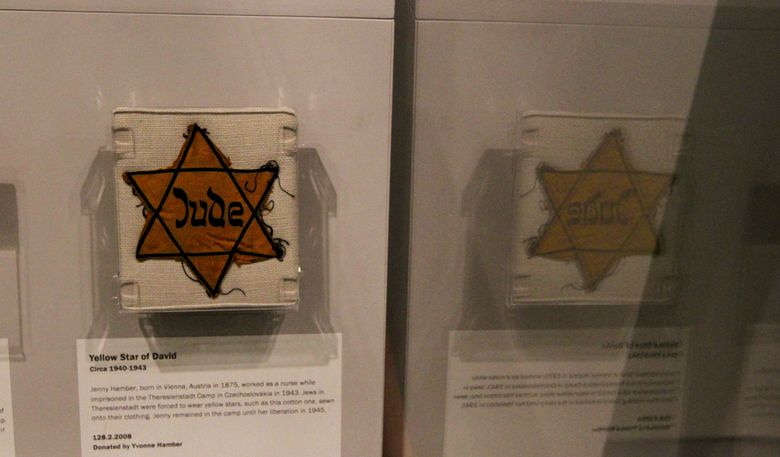
This screenshot has height=457, width=780. Find the location of `mirror`. mirror is located at coordinates (526, 122).